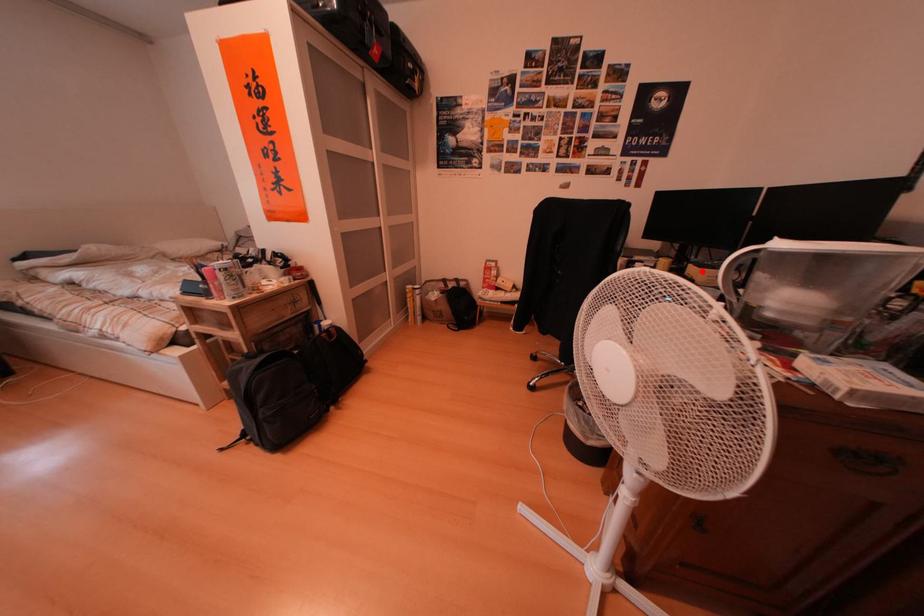
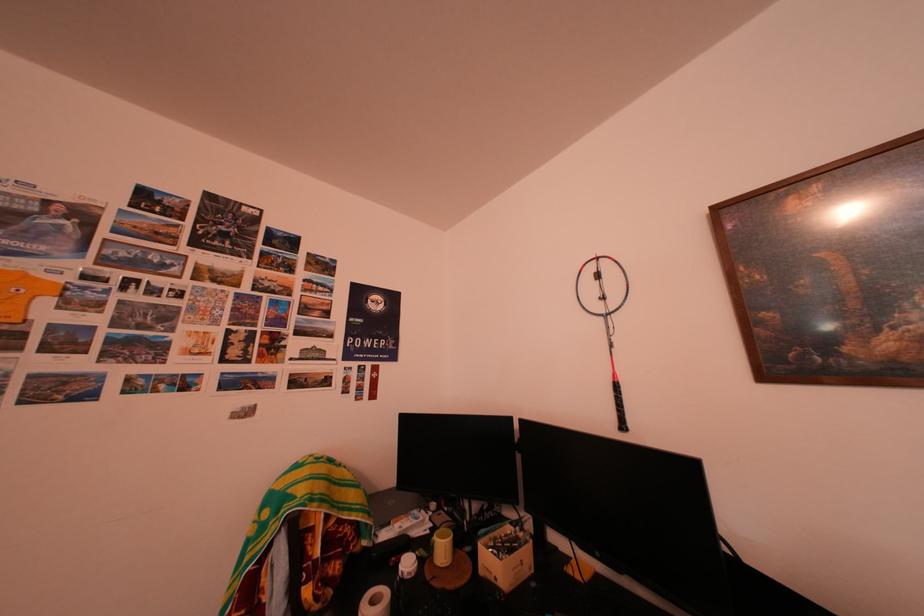
Question: I am providing you with two images of the same scene from different viewpoints. Image1 has a red point marked. In image2, the corresponding 3D location appears at what relative position? Reply with the corresponding letter.

Choices:
 (A) Closer
 (B) Farther

Answer: (A)